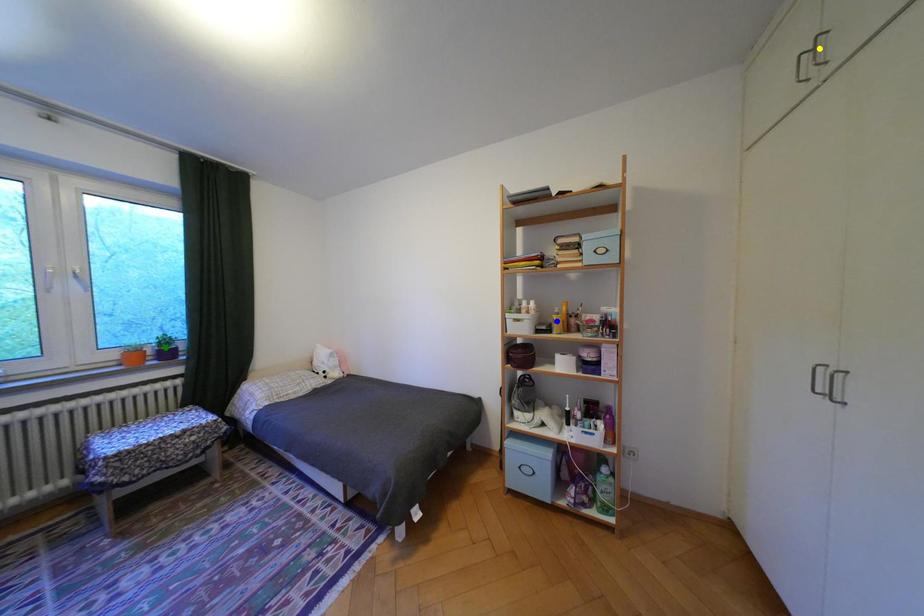
Order these from nearest to farthest:
green point
yellow point
blue point

green point
blue point
yellow point